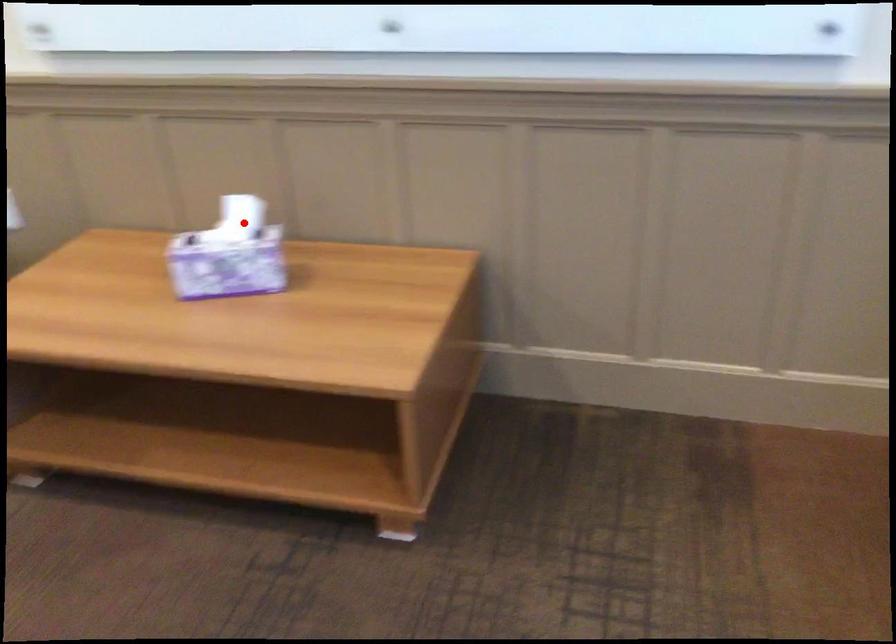
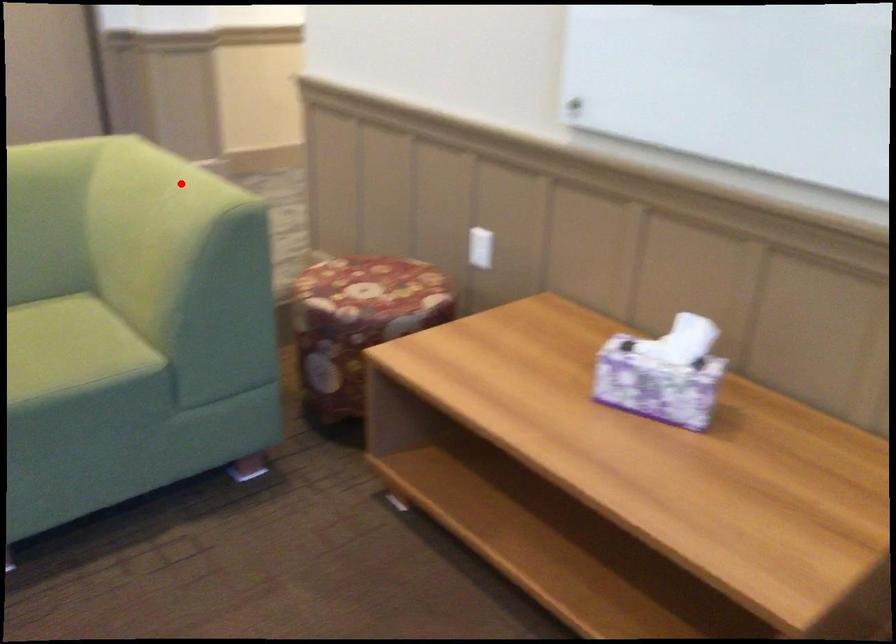
I am providing you with two images of the same scene from different viewpoints. A red point is marked on the first image and another point is marked on the second image. Are the points marked in image1 and image2 representing the same 3D position?

No